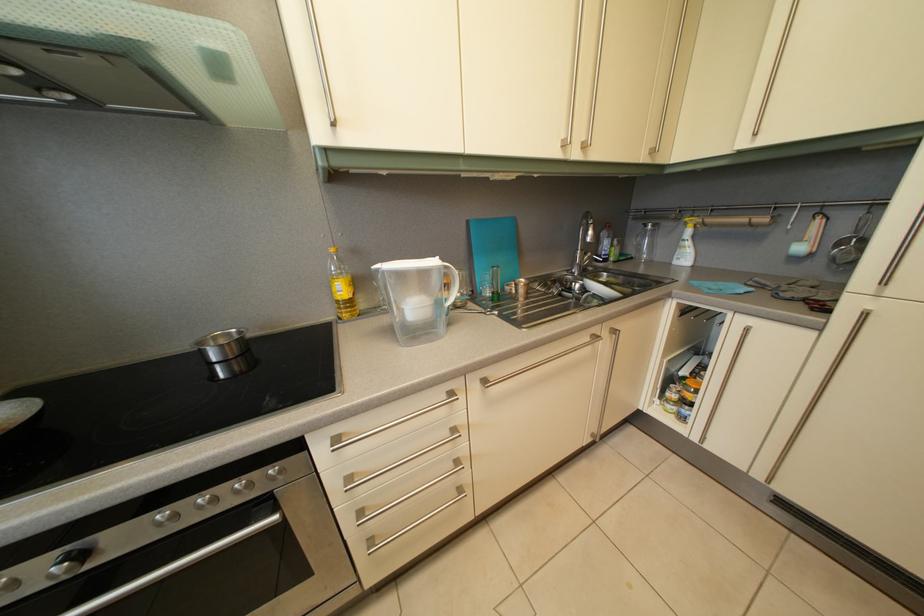
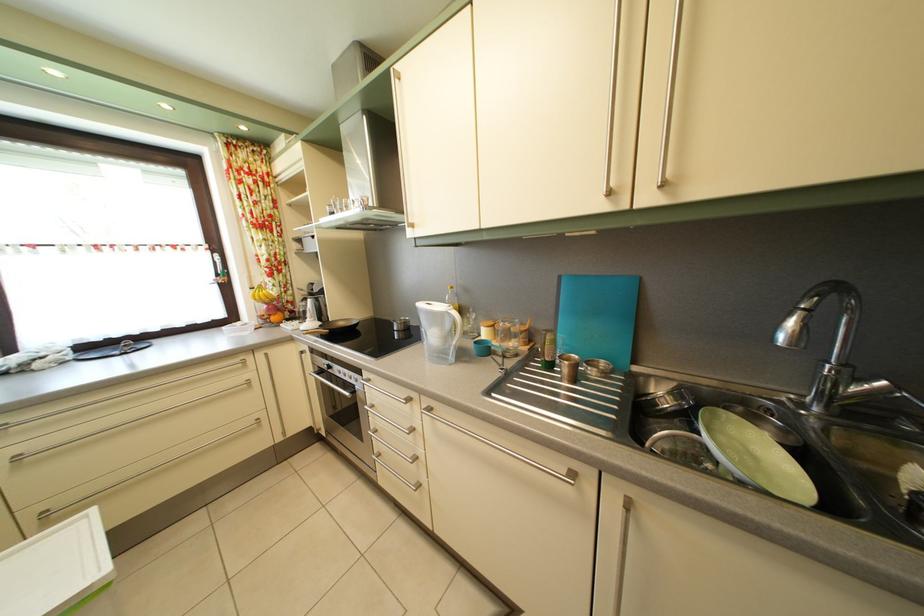
Locate, in the second image, the point that corresponds to point (598, 262) in the first image.

(893, 391)